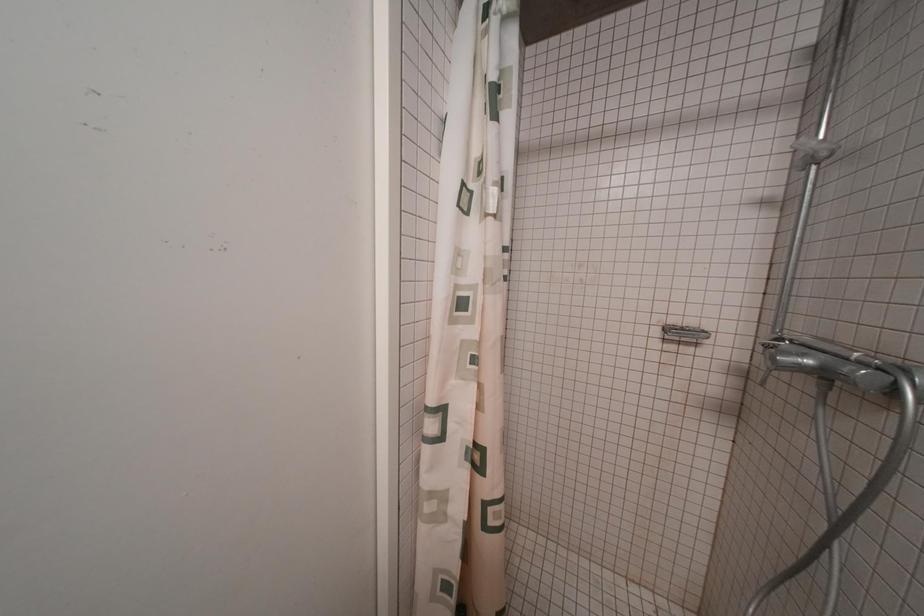
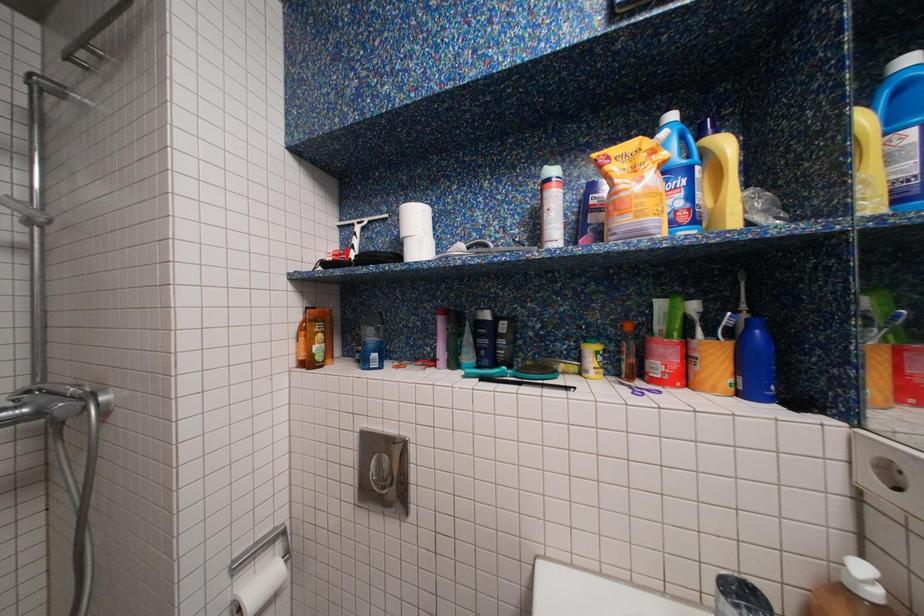
Question: Based on the continuous images, in which direction is the camera rotating? Reply with the corresponding letter.

Choices:
 (A) Left
 (B) Right
 (C) Up
 (D) Down

Answer: (B)